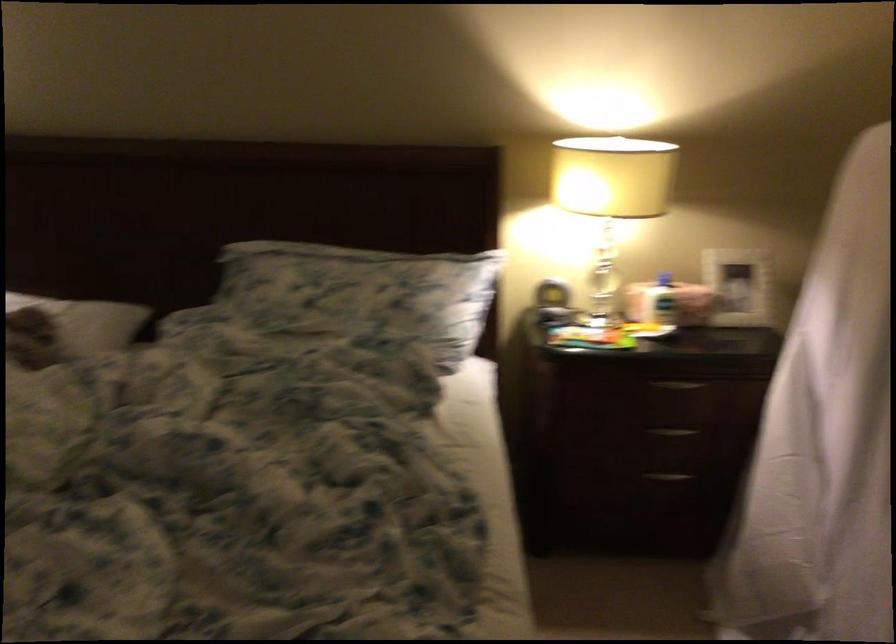
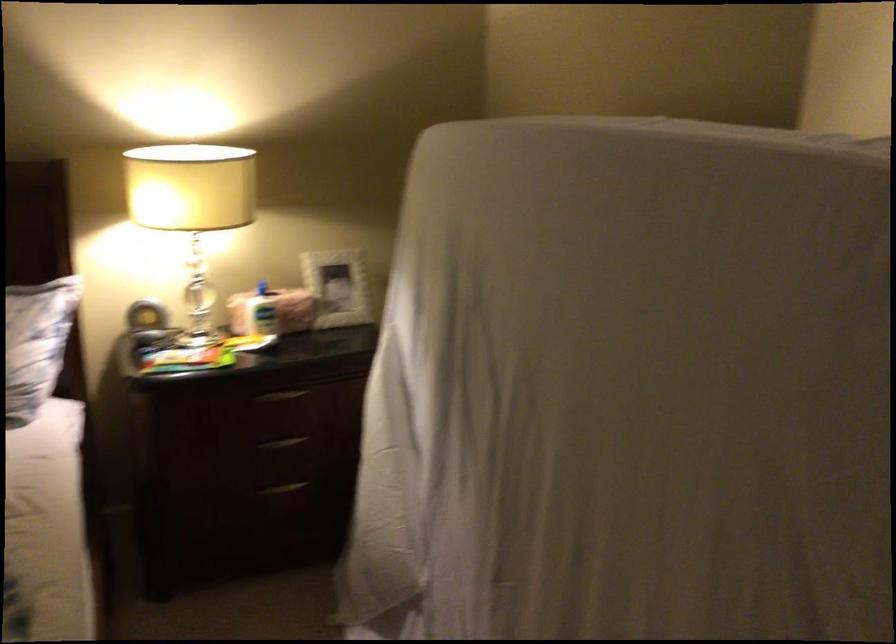
In the second image, find the point that corresponds to (555,289) in the first image.

(145, 316)